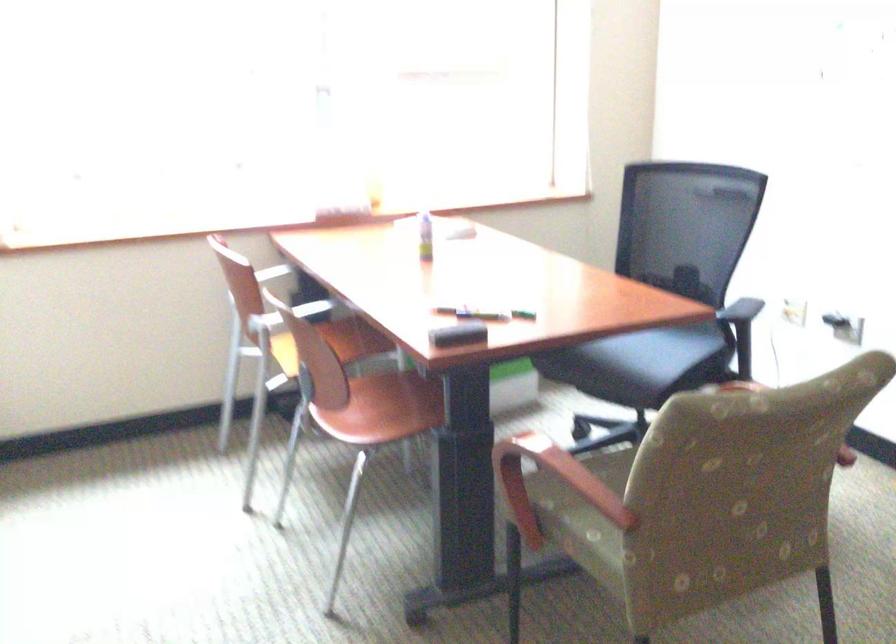
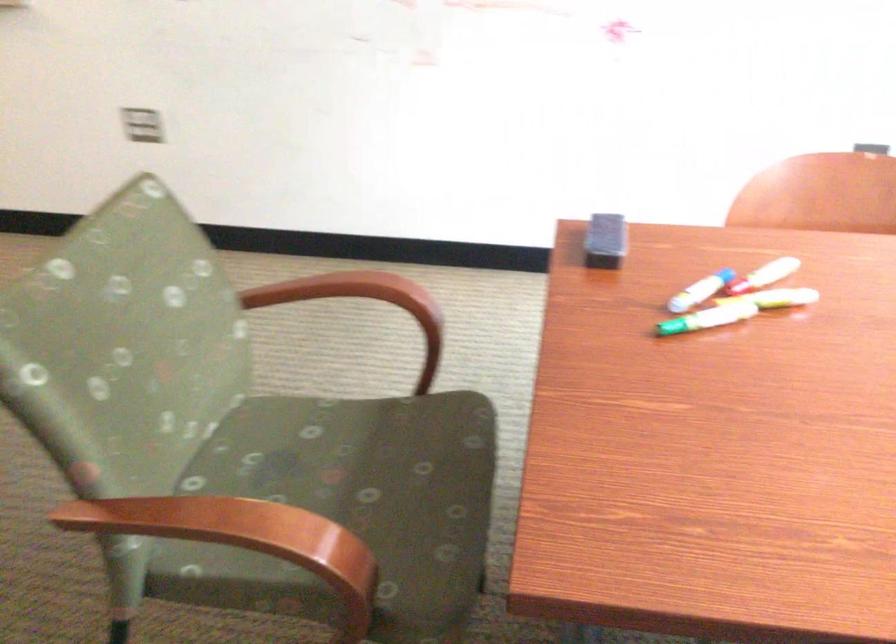
Find the pixel in the second image that matches the point at 468,303 in the first image.

(776, 298)